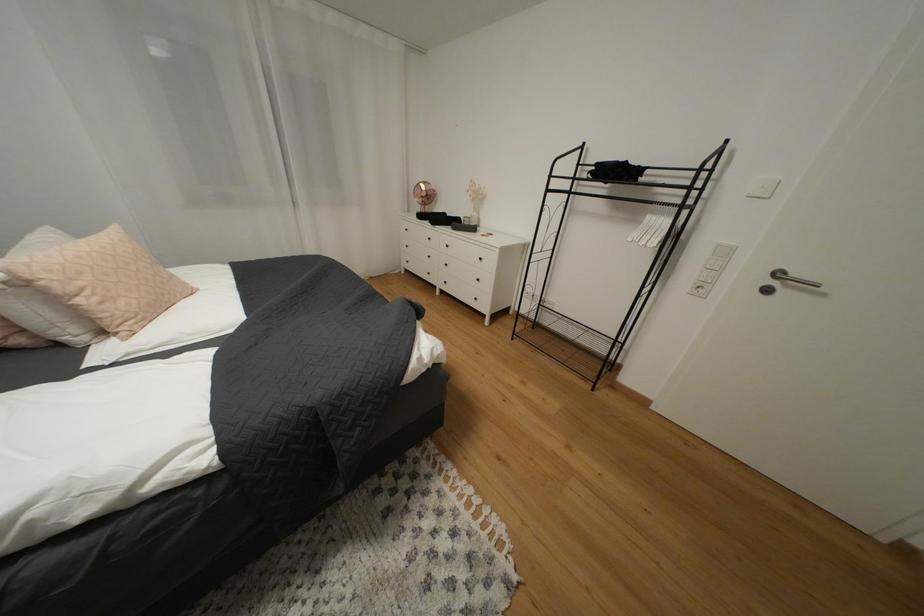
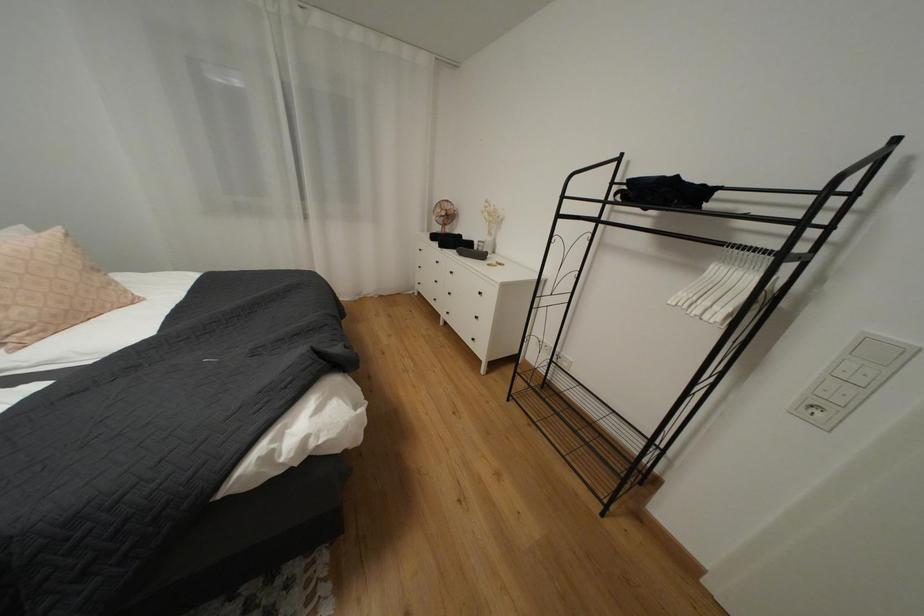
Question: The images are taken continuously from a first-person perspective. In which direction is your viewpoint rotating?

Choices:
 (A) Left
 (B) Right
 (C) Up
 (D) Down

Answer: (A)